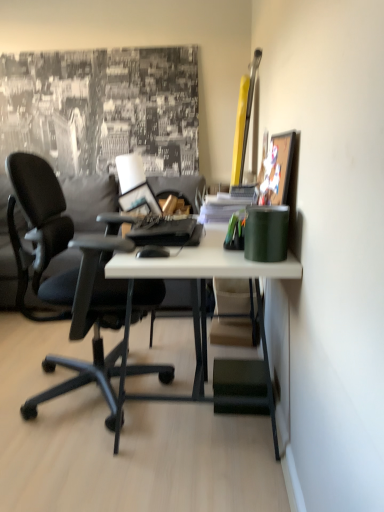
Locate an element on the screen. vacant space in front of green plastic pen holder at center, which ranks as the second stationery in front-to-back order is located at coordinates [x=231, y=258].